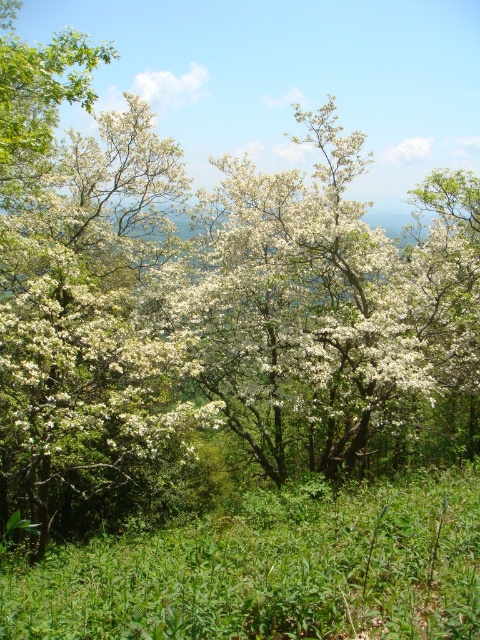
Is white matte flowers at center wider than green leafy grass at center?

Correct, the width of white matte flowers at center exceeds that of green leafy grass at center.

Does white matte flowers at center appear on the left side of green leafy grass at center?

Indeed, white matte flowers at center is positioned on the left side of green leafy grass at center.

Locate an element on the screen. white matte flowers at center is located at coordinates (228, 301).

At what (x,y) coordinates should I click in order to perform the action: click on white matte flowers at center. Please return your answer as a coordinate pair (x, y). The height and width of the screenshot is (640, 480). Looking at the image, I should click on (228, 301).